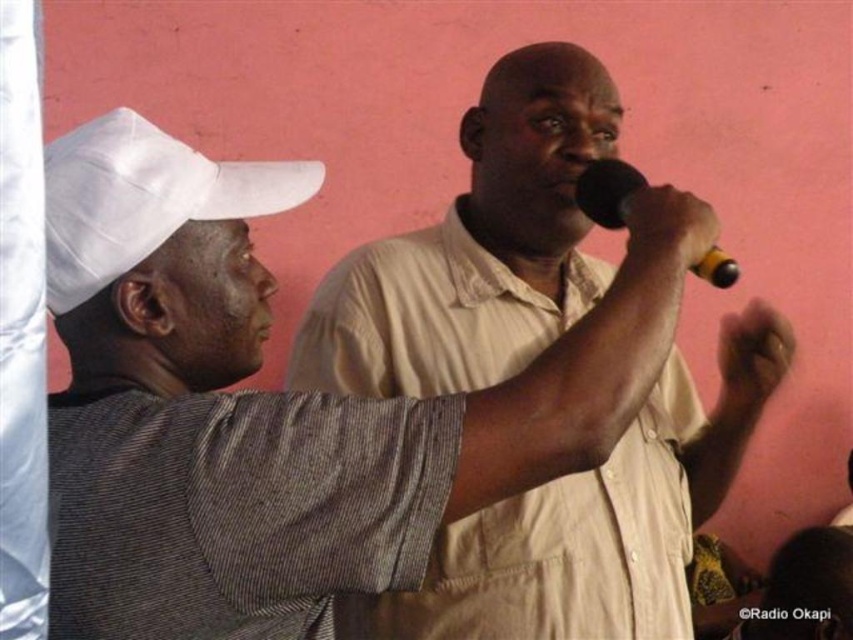
You are a photographer setting up for a photoshoot. You need to position a light source between the beige striped shirt at center and the white fabric cap at left. What is the minimum distance the light should be placed from each object to ensure it is centered between them?

The minimum distance the light should be placed from each object is half of 63.70 centimeters, which is 31.85 centimeters. This ensures the light is centered between the beige striped shirt at center and the white fabric cap at left.

You are a photographer standing at point (113, 168). You want to take a photo of both men so that they are in the same frame. The camera has a maximum focus range of 38 inches. Will you be able to capture both men in focus?

The distance between them is 38.83 inches, which exceeds the camera maximum focus range of 38 inches. Therefore, you cannot capture both men in focus.